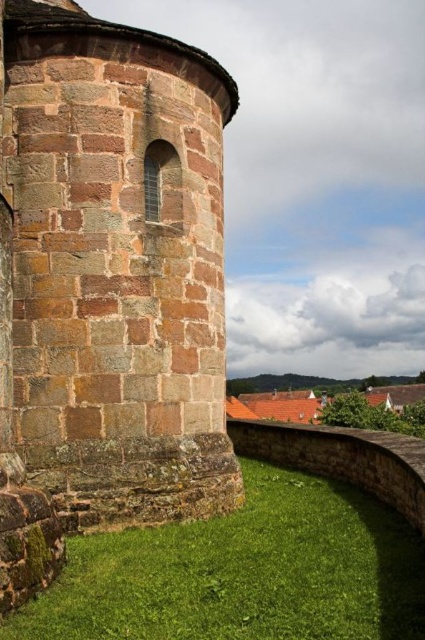
You are a painter standing at the base of the brown stone tower at left and want to paint the green grass at lower center. Which area will require you to cover more ground with paint?

The green grass at lower center requires more paint because it is wider than the brown stone tower at left.

You are standing in front of the historic stone structure. You notice the brown stone tower at left and the green grass at lower center. Which object is taller?

The brown stone tower at left is much taller than the green grass at lower center.